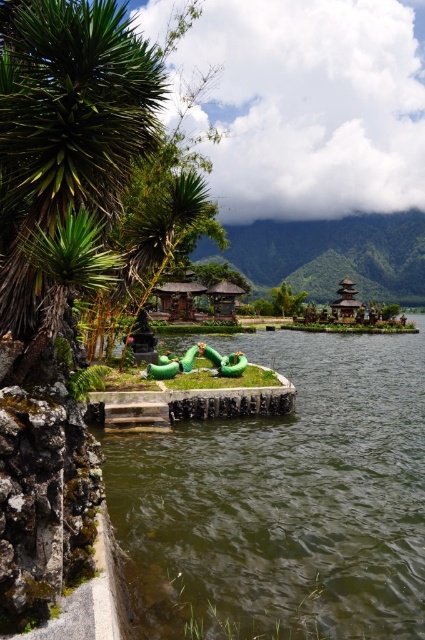
Question: Does green rubber tubes at center appear on the right side of green leafy palm tree at left?

Choices:
 (A) no
 (B) yes

Answer: (B)

Question: Which point is closer to the camera?

Choices:
 (A) (110, 76)
 (B) (320, 531)

Answer: (A)

Question: Does green rubber tubes at center have a greater width compared to green leafy palm tree at left?

Choices:
 (A) yes
 (B) no

Answer: (A)

Question: Which of the following is the closest to the observer?

Choices:
 (A) green rubber tubes at center
 (B) green leafy palm tree at left

Answer: (B)

Question: Does green rubber tubes at center appear on the right side of green leafy palm tree at left?

Choices:
 (A) no
 (B) yes

Answer: (B)